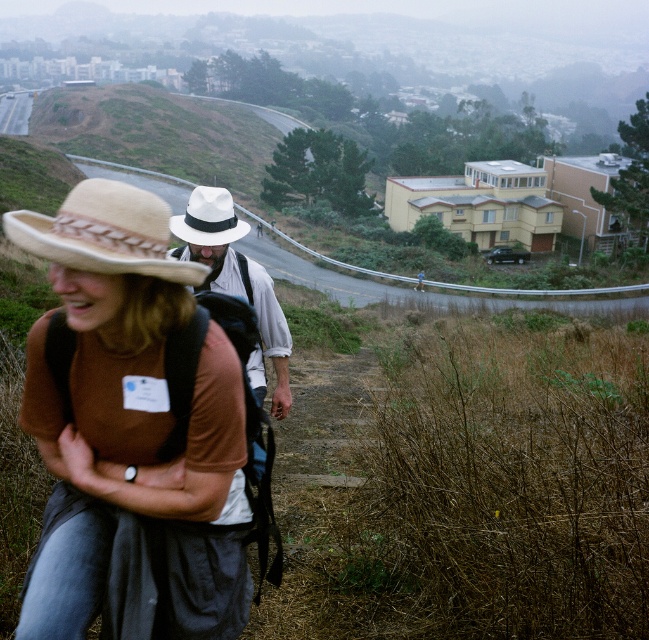
Is matte brown shirt at center below gravel road at center?

Indeed, matte brown shirt at center is positioned under gravel road at center.

Who is taller, matte brown shirt at center or gravel road at center?

With more height is gravel road at center.

Is point (86, 531) behind point (365, 280)?

No, (86, 531) is closer to viewer.

Where is `matte brown shirt at center`? matte brown shirt at center is located at coordinates (117, 396).

Is beige straw cowboy hat at center shorter than gravel road at center?

Correct, beige straw cowboy hat at center is not as tall as gravel road at center.

In the scene shown: Does beige straw cowboy hat at center have a greater width compared to gravel road at center?

In fact, beige straw cowboy hat at center might be narrower than gravel road at center.

At what (x,y) coordinates should I click in order to perform the action: click on beige straw cowboy hat at center. Please return your answer as a coordinate pair (x, y). The width and height of the screenshot is (649, 640). Looking at the image, I should click on (104, 232).

Does gravel road at center have a lesser width compared to white felt cowboy hat at center?

Incorrect, gravel road at center's width is not less than white felt cowboy hat at center's.

Does point (618, 314) lie in front of point (191, 228)?

No, (618, 314) is behind (191, 228).

Identify the location of gravel road at center. The width and height of the screenshot is (649, 640). (430, 291).